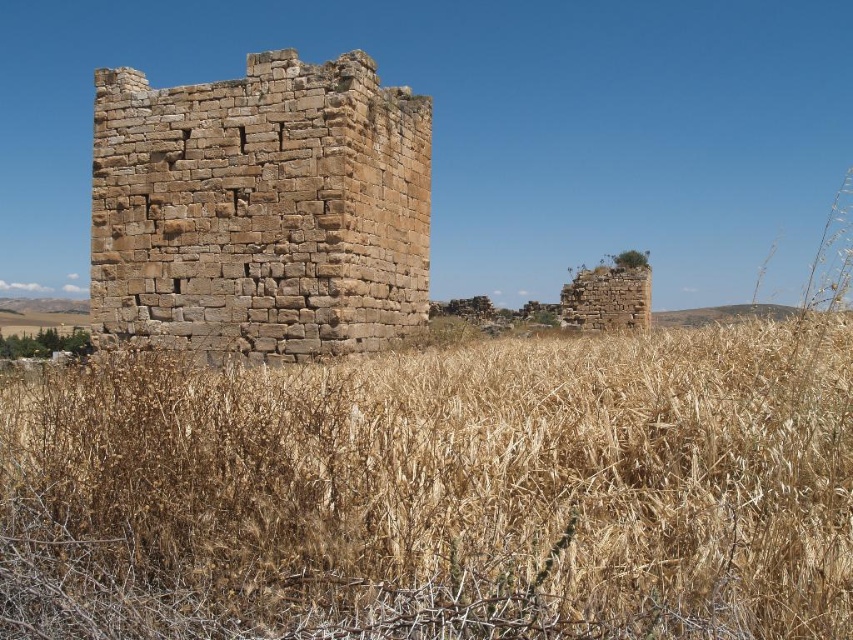
You are a farmer planning to plant crops in the field. You notice the brown dry grass at center and brown stone ruins at center. Which area would be more suitable for planting, considering the size of the vegetation and the structures?

The brown dry grass at center has a larger size compared to the brown stone ruins at center, so planting in the area with the brown dry grass at center would be more suitable as it offers more space for crops to grow.

In the scene shown: You are standing at the origin point in the image. Can you see the brown dry grass at center from your current position?

Yes, the brown dry grass at center is located at point (x=439, y=492), which is within your field of view from the origin point.